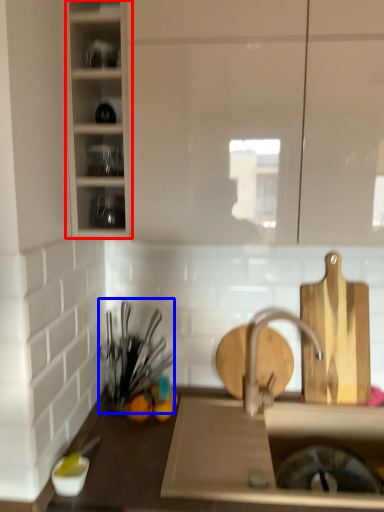
Question: Which of the following is the farthest to the observer, cabinetry (highlighted by a red box) or tableware (highlighted by a blue box)?

Choices:
 (A) cabinetry
 (B) tableware

Answer: (B)